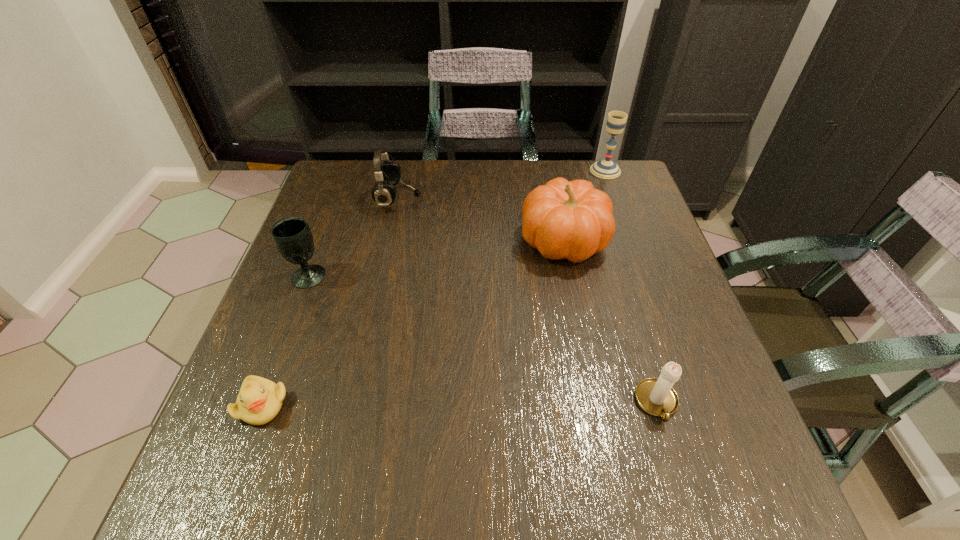
This screenshot has width=960, height=540. Identify the location of free region located 0.130m with the microphone on the side of the third object from left to right. (467, 198).

Locate an element on the screen. blank space located 0.120m on the right of the shorter chalice is located at coordinates (378, 276).

Where is `free point located on the handle side of the fifth tallest object`? free point located on the handle side of the fifth tallest object is located at coordinates (684, 494).

What are the coordinates of `free space located 0.110m on the beak of the duckling` in the screenshot? It's located at (228, 495).

The image size is (960, 540). I want to click on chalice that is at the far edge, so click(x=607, y=169).

The height and width of the screenshot is (540, 960). I want to click on headset present at the far edge, so click(387, 174).

The height and width of the screenshot is (540, 960). What are the coordinates of `headset that is at the left edge` in the screenshot? It's located at (387, 174).

Find the location of a particular element. Image resolution: width=960 pixels, height=540 pixels. chalice that is at the left edge is located at coordinates (292, 236).

Identify the location of duckling positioned at the left edge. This screenshot has width=960, height=540. (259, 400).

This screenshot has height=540, width=960. What are the coordinates of `chalice present at the right edge` in the screenshot? It's located at (607, 169).